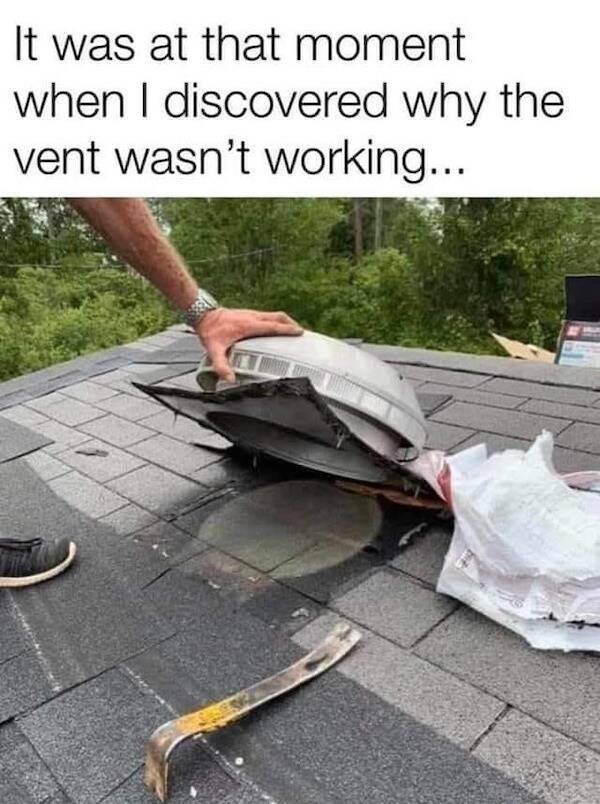
Image resolution: width=600 pixels, height=804 pixels. I want to click on vent, so click(x=346, y=370).